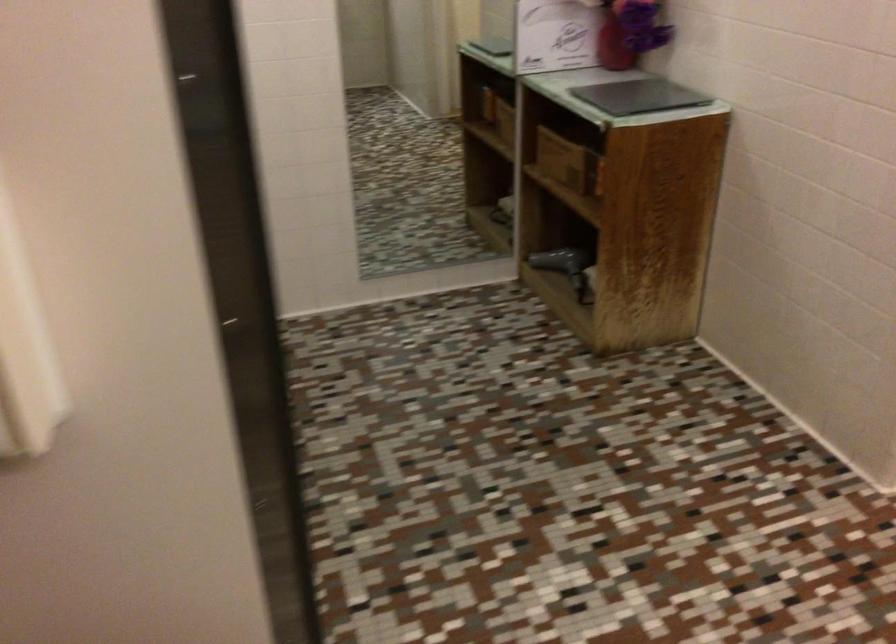
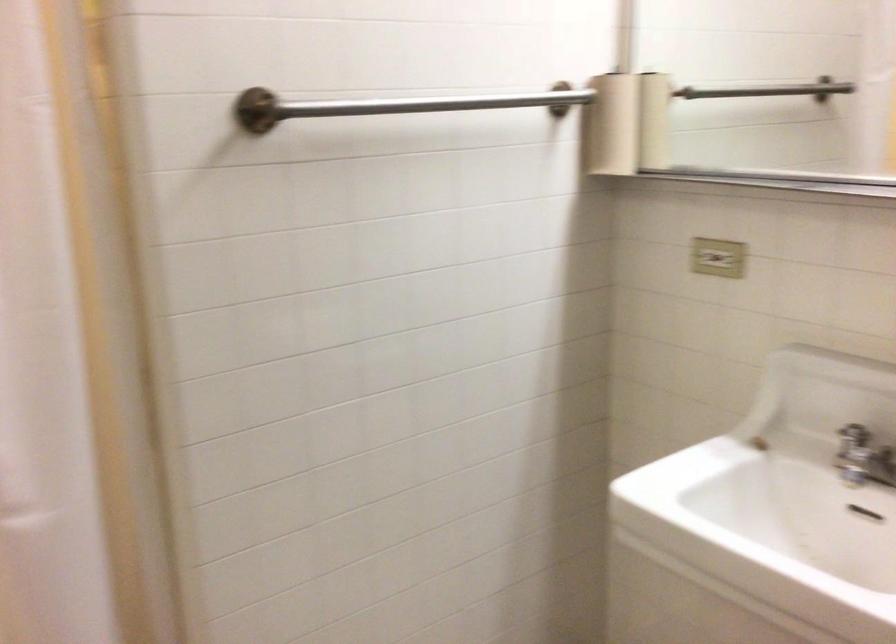
The first image is from the beginning of the video and the second image is from the end. How did the camera likely rotate when shooting the video?

The camera rotated toward right-down.